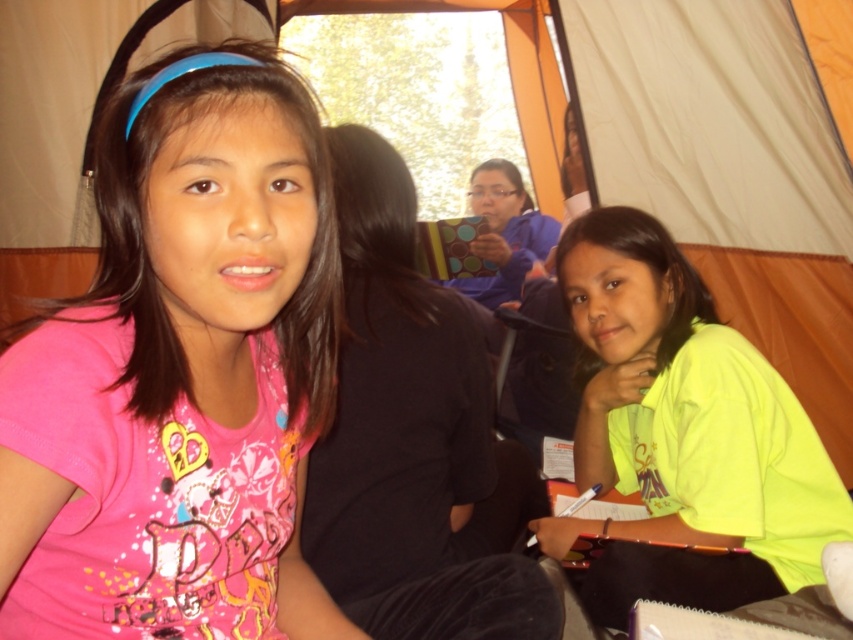
Can you confirm if pink fabric shirt at center is positioned to the right of neon yellow shirt at right?

No, pink fabric shirt at center is not to the right of neon yellow shirt at right.

Who is taller, pink fabric shirt at center or neon yellow shirt at right?

neon yellow shirt at right

This screenshot has width=853, height=640. In order to click on pink fabric shirt at center in this screenshot , I will do `click(183, 365)`.